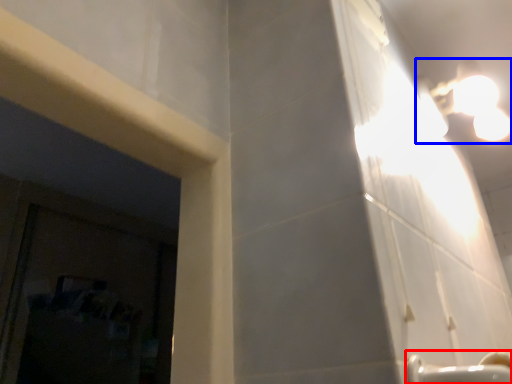
Question: Which object is closer to the camera taking this photo, faucet (highlighted by a red box) or light fixture (highlighted by a blue box)?

Choices:
 (A) faucet
 (B) light fixture

Answer: (A)